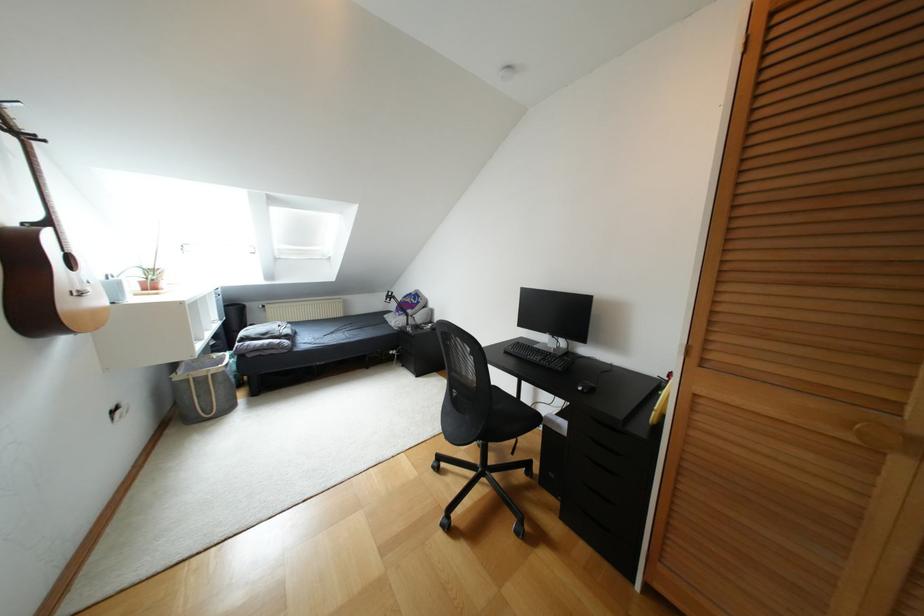
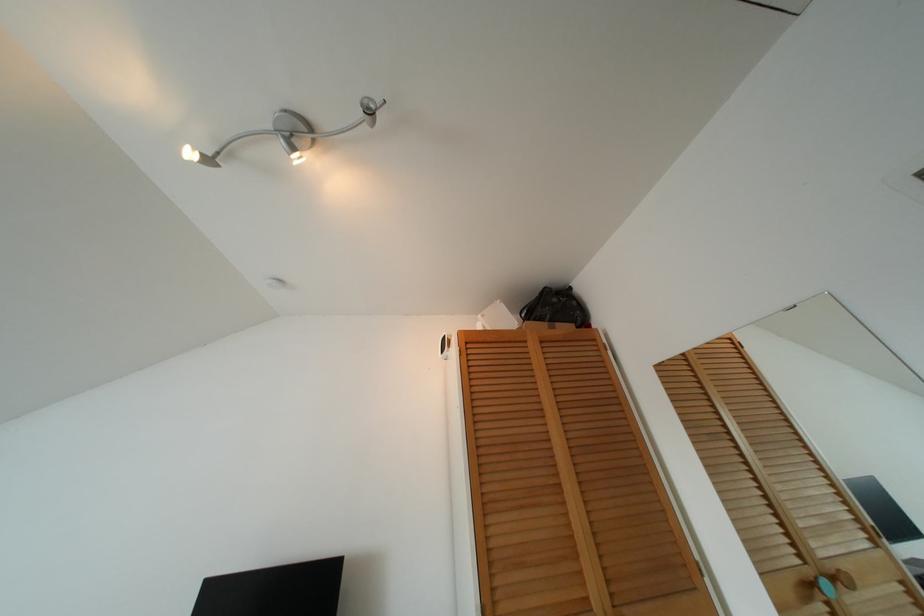
How did the camera likely rotate?

The camera rotated toward right-up.